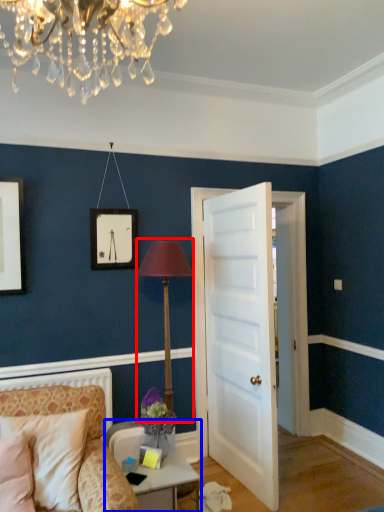
Question: Which of the following is the farthest to the observer, table lamp (highlighted by a red box) or table (highlighted by a blue box)?

Choices:
 (A) table lamp
 (B) table

Answer: (A)